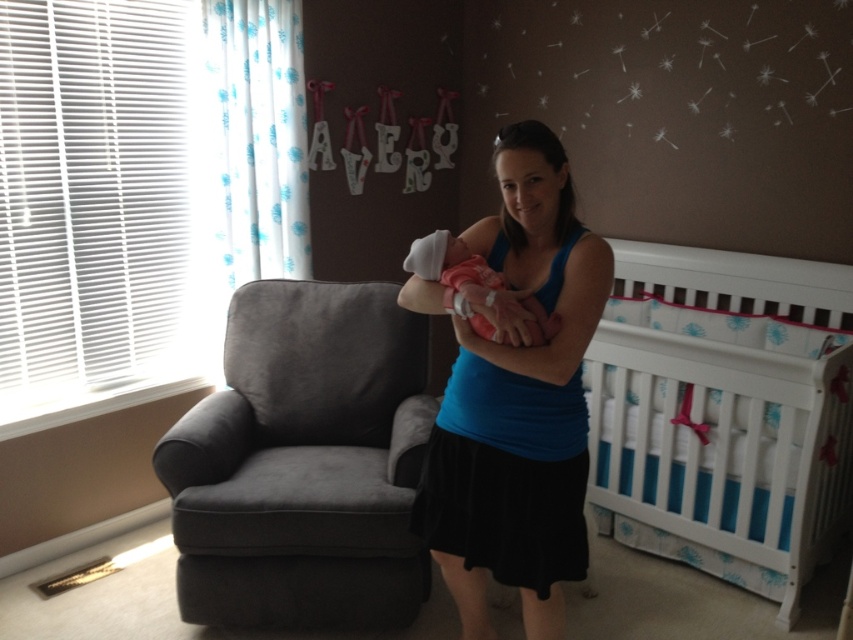
Question: Which of the following is the farthest from the observer?

Choices:
 (A) blue fabric tank top at center
 (B) dark gray suede armchair at left
 (C) pink fabric newborn at center
 (D) white wooden crib at right

Answer: (B)

Question: Which object appears farthest from the camera in this image?

Choices:
 (A) dark gray suede armchair at left
 (B) white wooden crib at right

Answer: (A)

Question: Observing the image, what is the correct spatial positioning of dark gray suede armchair at left in reference to pink fabric newborn at center?

Choices:
 (A) left
 (B) right

Answer: (A)

Question: Is dark gray suede armchair at left thinner than blue fabric tank top at center?

Choices:
 (A) no
 (B) yes

Answer: (A)

Question: Is dark gray suede armchair at left below blue fabric tank top at center?

Choices:
 (A) no
 (B) yes

Answer: (B)

Question: Which point is closer to the camera?

Choices:
 (A) pink fabric newborn at center
 (B) dark gray suede armchair at left
 (C) white wooden crib at right

Answer: (A)